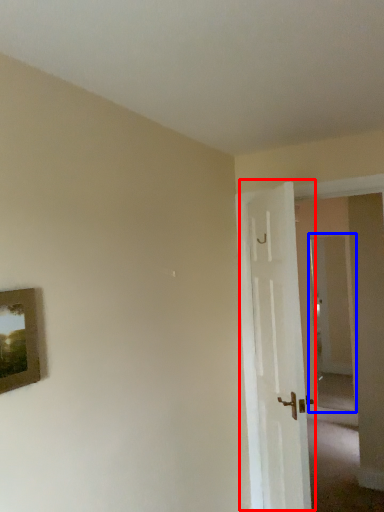
Question: Which object is closer to the camera taking this photo, door (highlighted by a red box) or glass door (highlighted by a blue box)?

Choices:
 (A) door
 (B) glass door

Answer: (A)